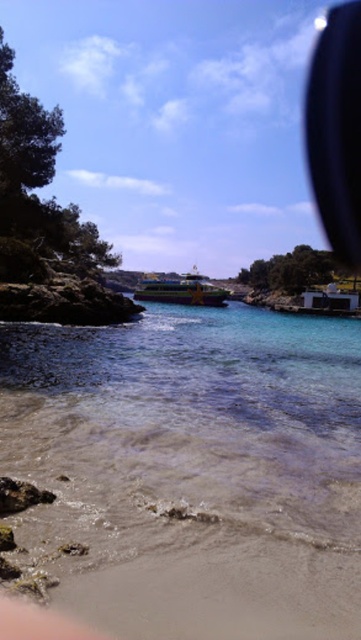
Question: Observing the image, what is the correct spatial positioning of black glossy view mirror at upper right in reference to green plastic boat at center?

Choices:
 (A) left
 (B) right

Answer: (B)

Question: Estimate the real-world distances between objects in this image. Which object is closer to the clear water at center?

Choices:
 (A) green plastic boat at center
 (B) black glossy view mirror at upper right

Answer: (A)

Question: Which point is closer to the camera?

Choices:
 (A) (297, 330)
 (B) (349, 22)
 (C) (210, 301)

Answer: (A)

Question: Does black glossy view mirror at upper right have a larger size compared to green plastic boat at center?

Choices:
 (A) no
 (B) yes

Answer: (B)

Question: Among these objects, which one is nearest to the camera?

Choices:
 (A) black glossy view mirror at upper right
 (B) clear water at center
 (C) green plastic boat at center

Answer: (B)

Question: From the image, what is the correct spatial relationship of clear water at center in relation to green plastic boat at center?

Choices:
 (A) right
 (B) left

Answer: (A)